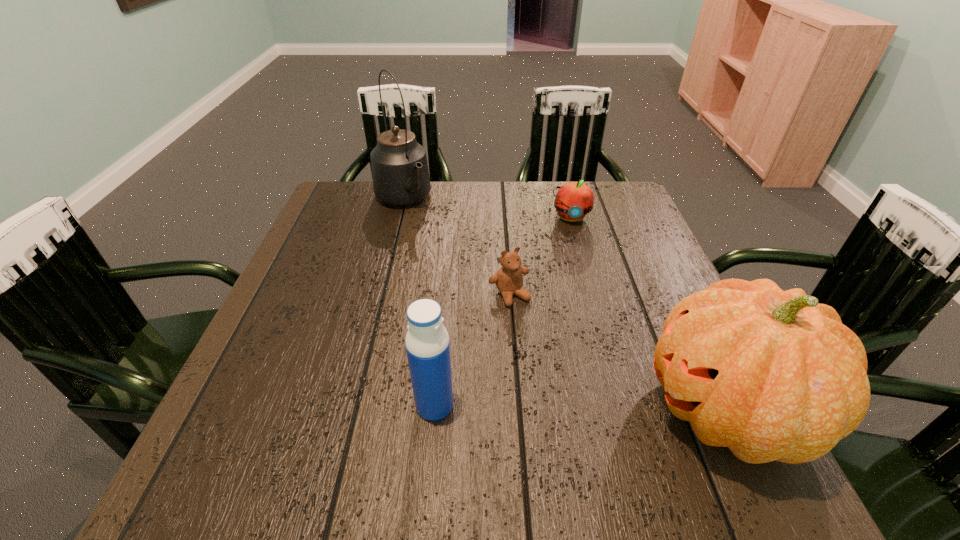
Find the location of a particular element. free space located 0.120m spout on the leftmost object is located at coordinates (433, 239).

You are a GUI agent. You are given a task and a screenshot of the screen. Output one action in this format:
    pyautogui.click(x=<x>, y=<y>)
    Task: Click on the apple positioned at the far edge
    Image resolution: width=960 pixels, height=540 pixels.
    Given the screenshot: What is the action you would take?
    pyautogui.click(x=574, y=200)

Locate an element on the screen. kettle that is positioned at the far edge is located at coordinates (400, 173).

Find the location of `water bottle that is at the near edge`. water bottle that is at the near edge is located at coordinates (427, 343).

Where is `pumpkin that is at the near edge`? The width and height of the screenshot is (960, 540). pumpkin that is at the near edge is located at coordinates (772, 375).

The height and width of the screenshot is (540, 960). In order to click on object that is at the left edge in this screenshot , I will do point(400,173).

The height and width of the screenshot is (540, 960). I want to click on pumpkin that is at the right edge, so click(772, 375).

Where is `apple present at the right edge`? apple present at the right edge is located at coordinates (574, 200).

You are a GUI agent. You are given a task and a screenshot of the screen. Output one action in this format:
    pyautogui.click(x=<x>, y=<y>)
    Task: Click on the object located at the far left corner
    This screenshot has height=540, width=960.
    Given the screenshot: What is the action you would take?
    pyautogui.click(x=400, y=173)

Where is `object at the far right corner`? This screenshot has height=540, width=960. object at the far right corner is located at coordinates (574, 200).